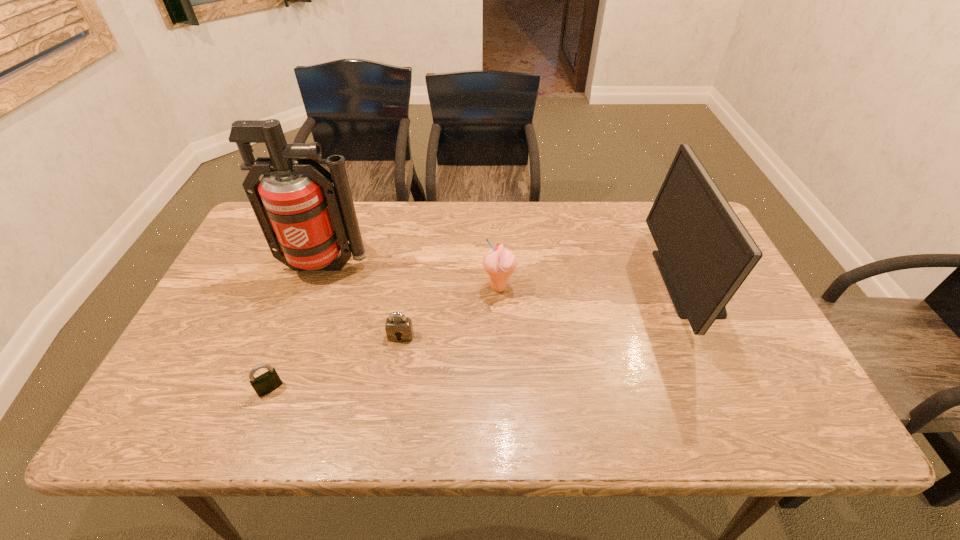
This screenshot has height=540, width=960. In the image, there is a desktop. In order to click on blank space at the far edge in this screenshot , I will do `click(422, 201)`.

I want to click on vacant space at the near edge of the desktop, so click(x=295, y=432).

The height and width of the screenshot is (540, 960). Identify the location of vacant space at the left edge. (241, 329).

At what (x,y) coordinates should I click in order to perform the action: click on free space at the right edge of the desktop. Please return your answer as a coordinate pair (x, y). The width and height of the screenshot is (960, 540). Looking at the image, I should click on (772, 395).

In the image, there is a desktop. Where is `free region at the far left corner`? free region at the far left corner is located at coordinates (259, 239).

Locate an element on the screen. The image size is (960, 540). vacant space at the near right corner of the desktop is located at coordinates 810,410.

Locate an element on the screen. Image resolution: width=960 pixels, height=540 pixels. free spot between the third tallest object and the tallest object is located at coordinates (412, 277).

In order to click on free space between the third tallest object and the farther padlock in this screenshot , I will do [x=450, y=312].

At what (x,y) coordinates should I click in order to perform the action: click on free space between the third object from right to left and the fire extinguisher. Please return your answer as a coordinate pair (x, y). Looking at the image, I should click on (363, 301).

Where is `vacant space that's between the second object from right to left and the fire extinguisher`? The height and width of the screenshot is (540, 960). vacant space that's between the second object from right to left and the fire extinguisher is located at coordinates (412, 277).